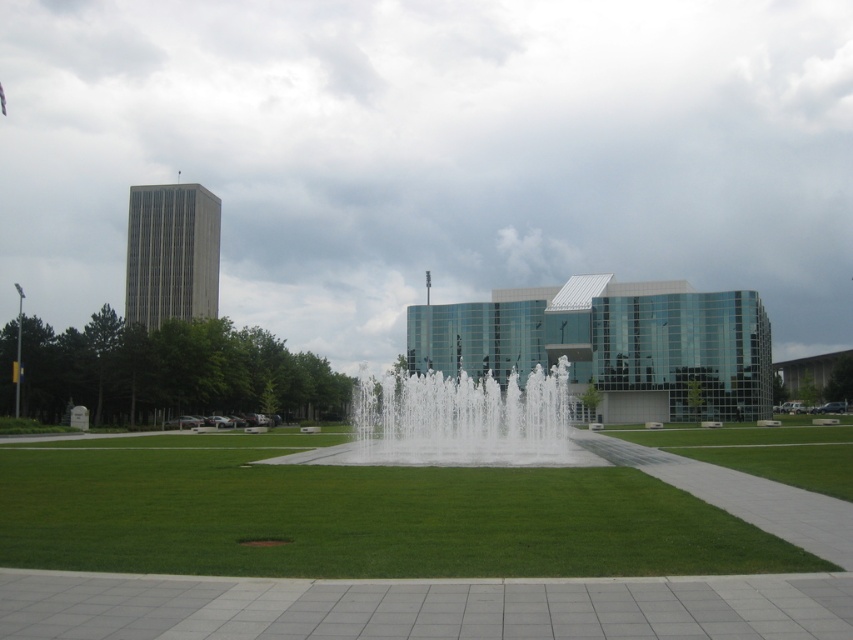
Question: Does green grass at center appear on the right side of white water at center?

Choices:
 (A) yes
 (B) no

Answer: (B)

Question: Which object is farther from the camera taking this photo?

Choices:
 (A) white water at center
 (B) green grass at center

Answer: (A)

Question: Is green grass at center smaller than white water at center?

Choices:
 (A) no
 (B) yes

Answer: (B)

Question: Does green grass at center have a lesser width compared to white water at center?

Choices:
 (A) no
 (B) yes

Answer: (B)

Question: Which object is closer to the camera taking this photo?

Choices:
 (A) white water at center
 (B) green grass at center

Answer: (B)

Question: Which object appears closest to the camera in this image?

Choices:
 (A) green grass at center
 (B) white water at center

Answer: (A)